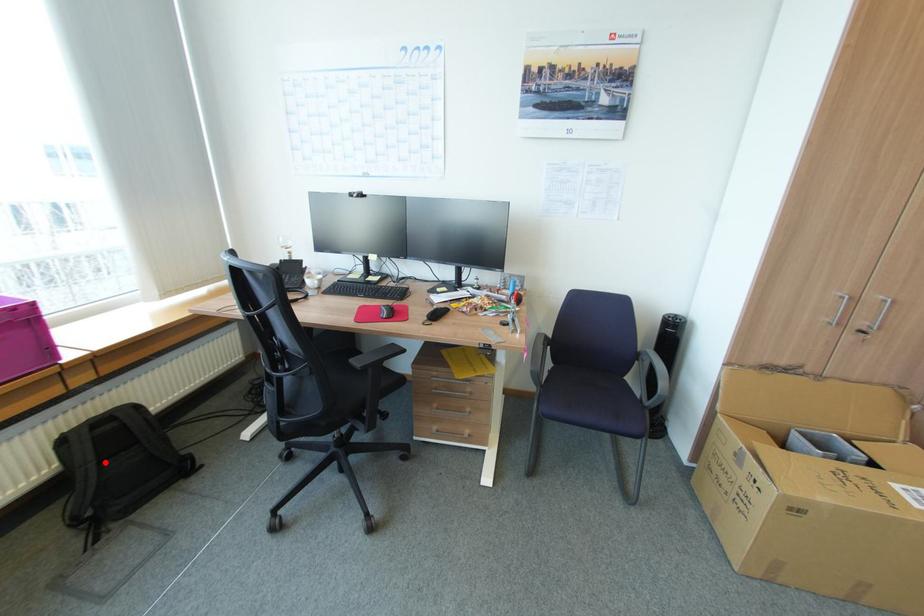
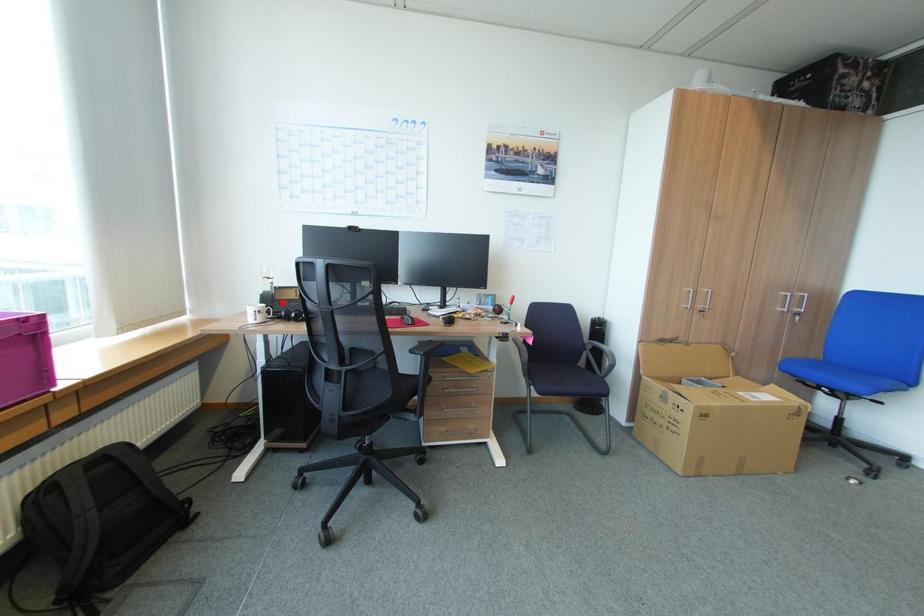
I am providing you with two images of the same scene from different viewpoints. A red point is marked on the first image and another point is marked on the second image. Is the red point in image1 aligned with the point shown in image2?

No